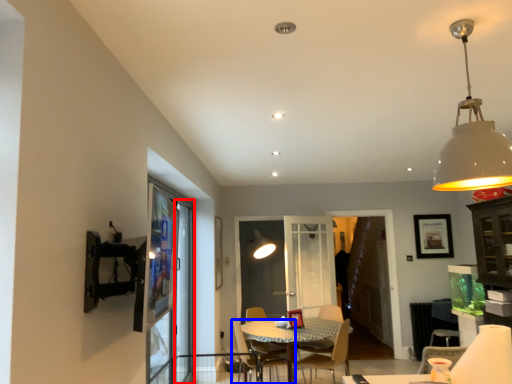
Question: Which of the following is the farthest to the observer, screen door (highlighted by a red box) or chair (highlighted by a blue box)?

Choices:
 (A) screen door
 (B) chair

Answer: (A)